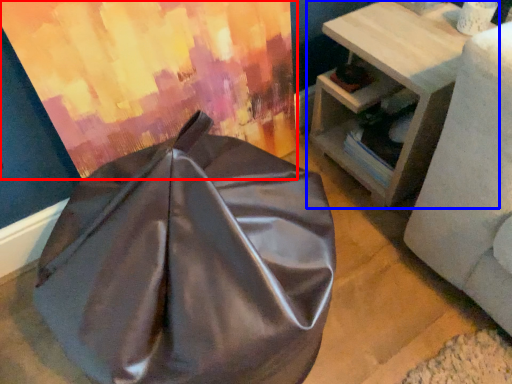
Question: Which point is closer to the camera, curtain (highlighted by a red box) or table (highlighted by a blue box)?

Choices:
 (A) curtain
 (B) table

Answer: (A)